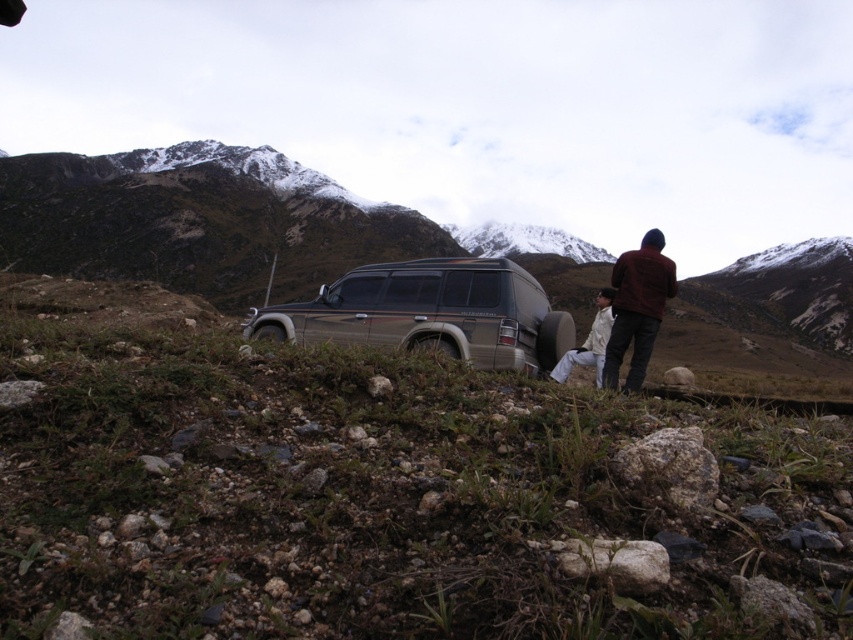
Question: Which point is farther to the camera?

Choices:
 (A) (355, 324)
 (B) (489, 224)

Answer: (B)

Question: Which object is farther from the camera taking this photo?

Choices:
 (A) snowy granite mountain at upper center
 (B) satin gold suv at center

Answer: (A)

Question: Does satin gold suv at center come behind dark red sweater at right?

Choices:
 (A) yes
 (B) no

Answer: (B)

Question: Is satin gold suv at center positioned behind dark red sweater at right?

Choices:
 (A) yes
 (B) no

Answer: (B)

Question: Does satin gold suv at center appear over white matte pants at center?

Choices:
 (A) no
 (B) yes

Answer: (B)

Question: Which of the following is the farthest from the observer?

Choices:
 (A) (422, 269)
 (B) (635, 369)
 (C) (558, 369)
 (D) (596, 246)

Answer: (D)